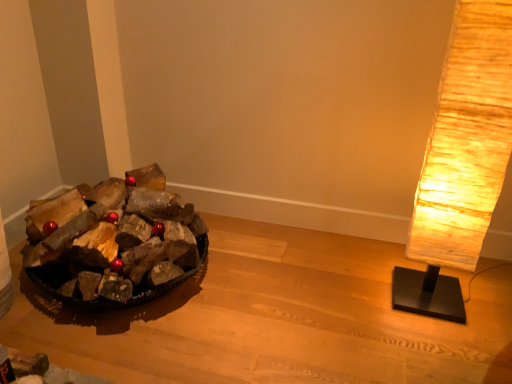
Question: Considering the relative sizes of rustic paper lamp at right and dark brown wood at left in the image provided, is rustic paper lamp at right wider than dark brown wood at left?

Choices:
 (A) no
 (B) yes

Answer: (A)

Question: Is the depth of rustic paper lamp at right greater than that of dark brown wood at left?

Choices:
 (A) yes
 (B) no

Answer: (B)

Question: From a real-world perspective, is rustic paper lamp at right beneath dark brown wood at left?

Choices:
 (A) yes
 (B) no

Answer: (B)

Question: Is rustic paper lamp at right to the left of dark brown wood at left from the viewer's perspective?

Choices:
 (A) yes
 (B) no

Answer: (B)

Question: From the image's perspective, is rustic paper lamp at right on top of dark brown wood at left?

Choices:
 (A) no
 (B) yes

Answer: (B)

Question: Is rustic paper lamp at right taller than dark brown wood at left?

Choices:
 (A) no
 (B) yes

Answer: (B)

Question: Can you confirm if rustic paper lamp at right is bigger than wooden logs at left?

Choices:
 (A) no
 (B) yes

Answer: (B)

Question: Is rustic paper lamp at right looking in the opposite direction of wooden logs at left?

Choices:
 (A) no
 (B) yes

Answer: (A)

Question: Is rustic paper lamp at right shorter than wooden logs at left?

Choices:
 (A) yes
 (B) no

Answer: (B)

Question: From a real-world perspective, is rustic paper lamp at right over wooden logs at left?

Choices:
 (A) yes
 (B) no

Answer: (A)

Question: Is wooden logs at left inside rustic paper lamp at right?

Choices:
 (A) no
 (B) yes

Answer: (A)

Question: Is rustic paper lamp at right located outside wooden logs at left?

Choices:
 (A) no
 (B) yes

Answer: (B)

Question: Considering the relative sizes of wooden logs at left and rustic paper lamp at right in the image provided, is wooden logs at left bigger than rustic paper lamp at right?

Choices:
 (A) yes
 (B) no

Answer: (B)